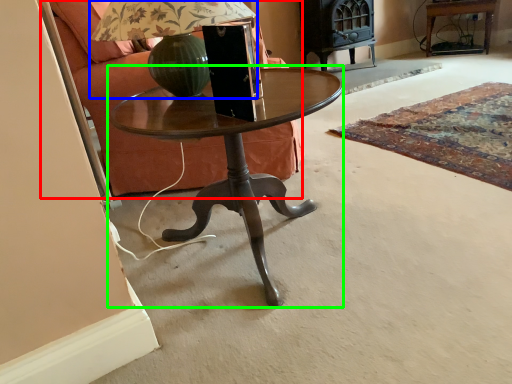
Question: Which object is positioned closest to armchair (highlighted by a red box)? Select from table lamp (highlighted by a blue box) and coffee table (highlighted by a green box).

Choices:
 (A) table lamp
 (B) coffee table

Answer: (A)